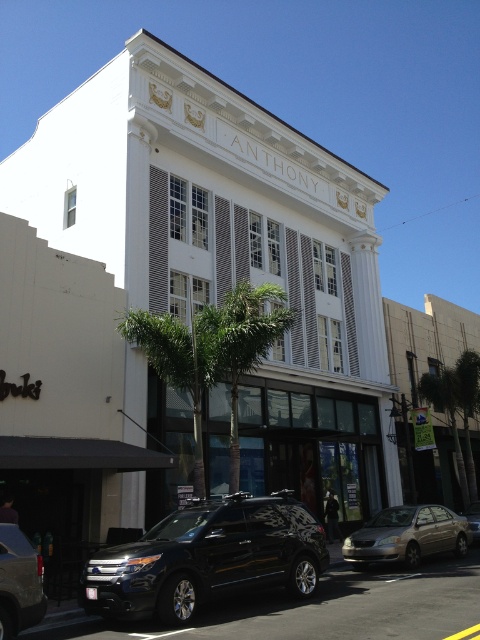
Question: Does silver metallic sedan at lower center have a greater width compared to metallic silver suv at lower left?

Choices:
 (A) yes
 (B) no

Answer: (B)

Question: Estimate the real-world distances between objects in this image. Which object is farther from the metallic silver suv at center?

Choices:
 (A) glossy black suv at lower left
 (B) metallic silver suv at lower left
 (C) silver metallic sedan at lower center

Answer: (B)

Question: Which object is positioned closest to the metallic silver suv at center?

Choices:
 (A) glossy black suv at lower left
 (B) metallic silver suv at lower left
 (C) silver metallic sedan at lower center

Answer: (C)

Question: Does silver metallic sedan at lower center have a greater width compared to metallic silver suv at center?

Choices:
 (A) no
 (B) yes

Answer: (A)

Question: Is glossy black suv at lower left smaller than silver metallic sedan at lower center?

Choices:
 (A) yes
 (B) no

Answer: (B)

Question: Which of these objects is positioned closest to the metallic silver suv at lower left?

Choices:
 (A) silver metallic sedan at lower center
 (B) metallic silver suv at center

Answer: (A)